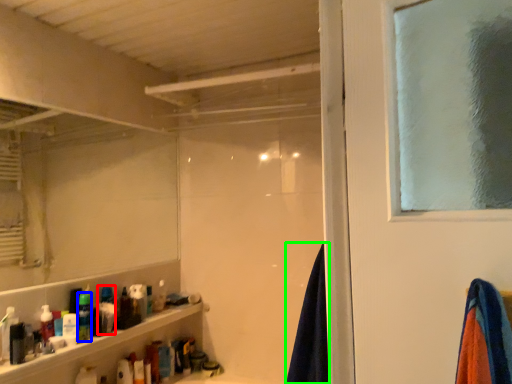
Question: Which object is positioned closest to toiletry (highlighted by a red box)? Select from toiletry (highlighted by a blue box) and beach towel (highlighted by a green box).

Choices:
 (A) toiletry
 (B) beach towel

Answer: (A)